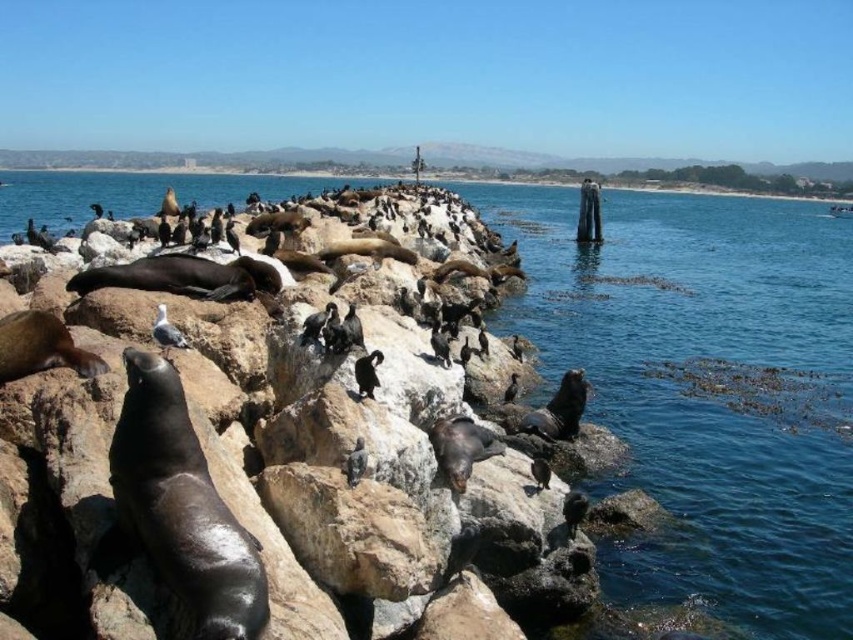
Is clear blue water at center below smooth rock at center?

Yes, clear blue water at center is below smooth rock at center.

Does point (643, 348) come behind point (558, 340)?

No, it is not.

Locate an element on the screen. The image size is (853, 640). clear blue water at center is located at coordinates click(x=705, y=388).